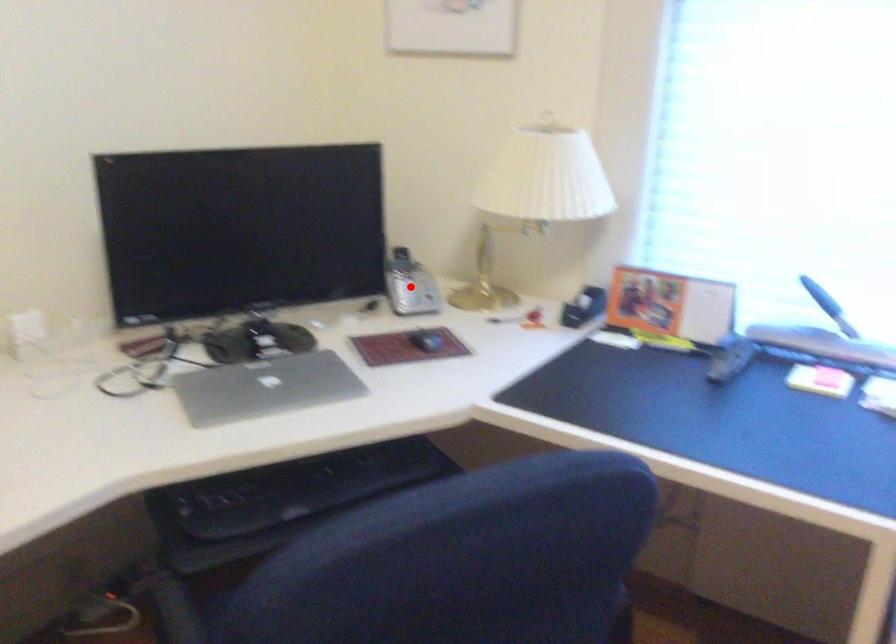
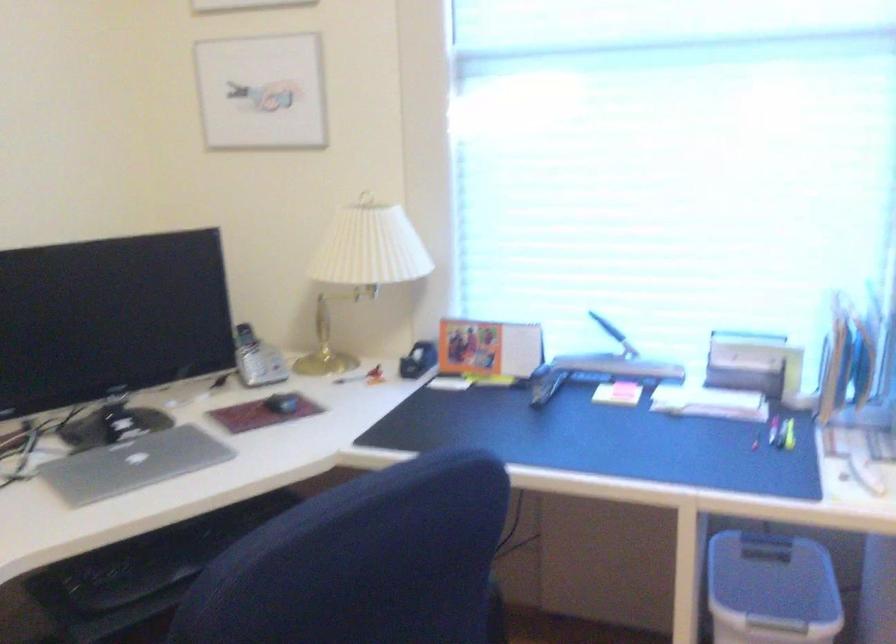
The point at the highlighted location is marked in the first image. Where is the corresponding point in the second image?

(256, 359)